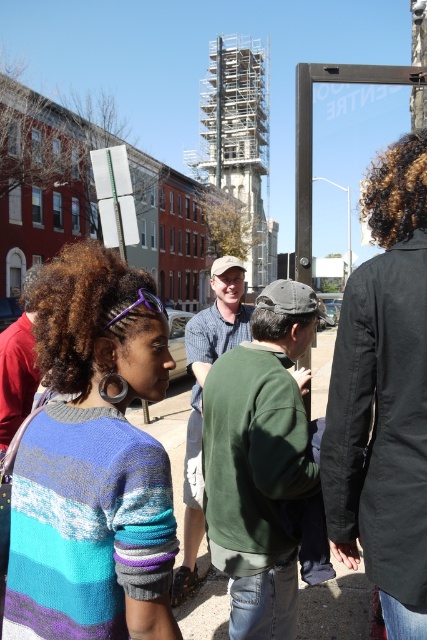
You are a photographer trying to capture a candid shot of the checkered shirt at center without the knitted sweater at center blocking it. Based on their positions, is this possible?

The knitted sweater at center is in front of the checkered shirt at center, so it is blocking the view. To capture the checkered shirt at center without obstruction, you would need to reposition yourself or wait for them to move.

You are a photographer trying to capture a candid shot of the checkered shirt at center without the green matte sweatshirt at center blocking the view. Is it possible to adjust your position to achieve this?

The green matte sweatshirt at center is in front of the checkered shirt at center, so adjusting your position might allow you to capture the checkered shirt at center without obstruction. Moving to the side or behind the green matte sweatshirt at center could provide an unobstructed view.